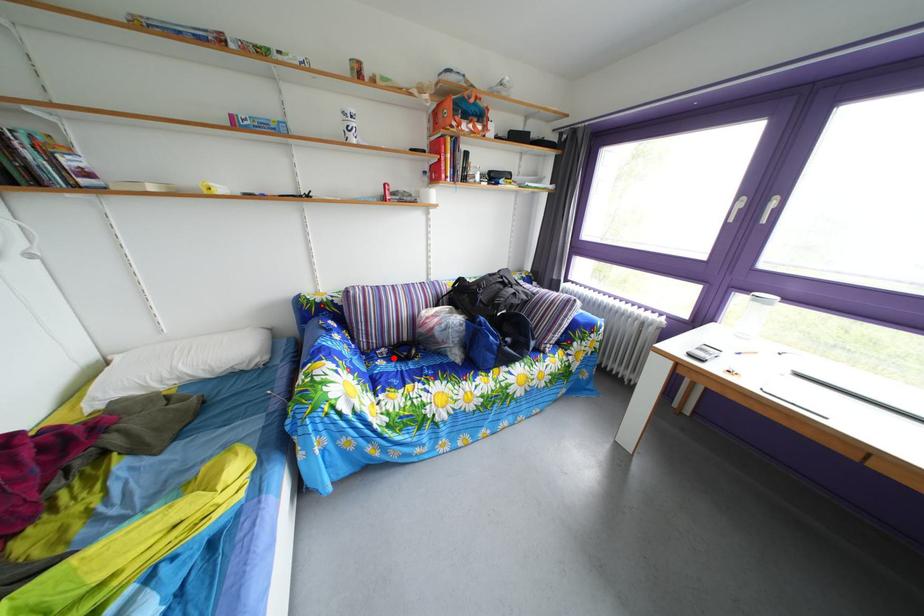
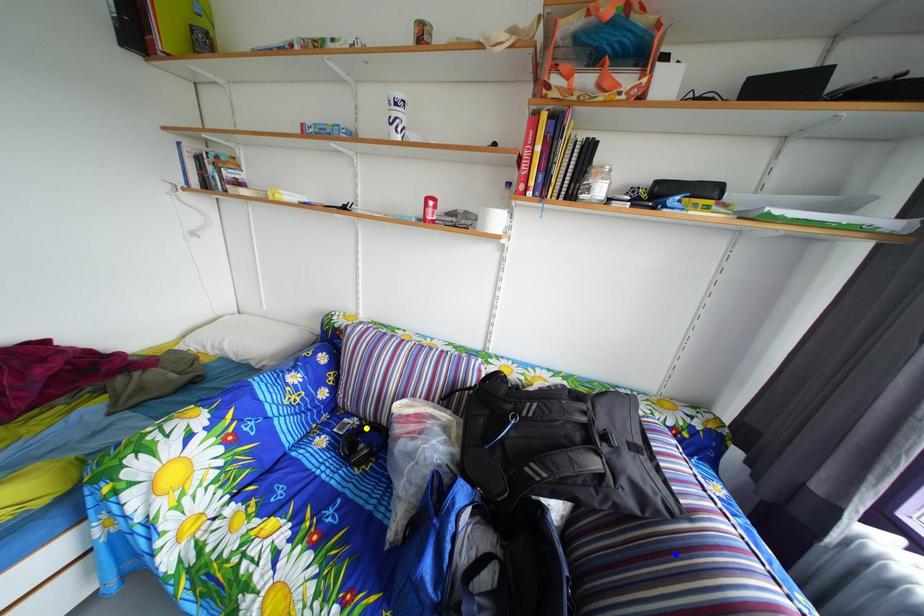
Question: I am providing you with two images of the same scene from different viewpoints. A red point is marked on the first image. You are given multiple points on the second image. Which spot in image 2 lines up with the point in image 1?

Choices:
 (A) yellow point
 (B) blue point
 (C) green point

Answer: (A)